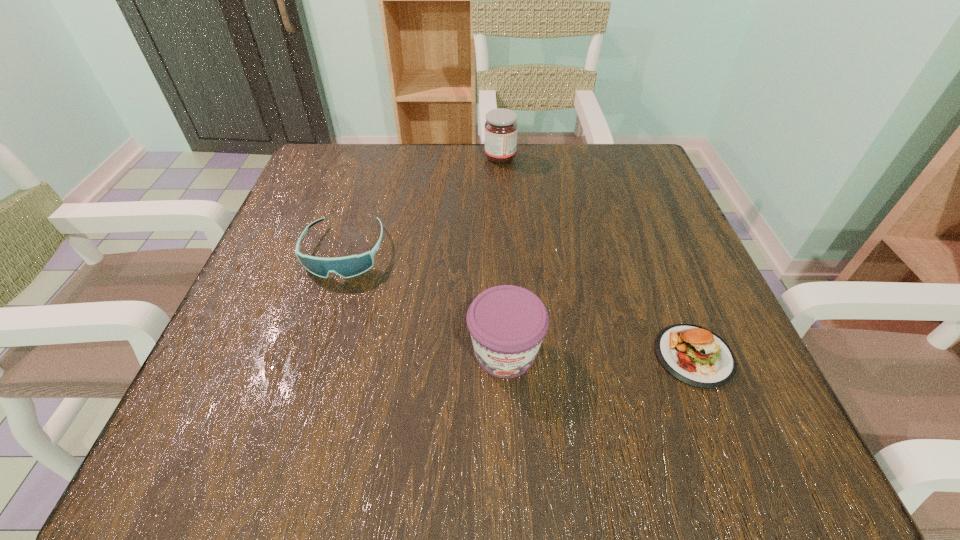
In the image, there is a desktop. Where is `vacant region at the near right corner`? The image size is (960, 540). vacant region at the near right corner is located at coordinates click(695, 417).

This screenshot has height=540, width=960. Identify the location of empty space between the nearer jam and the second shortest object. (425, 302).

Where is `free space between the farther jam and the leftmost object`? The width and height of the screenshot is (960, 540). free space between the farther jam and the leftmost object is located at coordinates (422, 205).

You are a GUI agent. You are given a task and a screenshot of the screen. Output one action in this format:
    pyautogui.click(x=<x>, y=<y>)
    Task: Click on the free spot between the farthest object and the leftmost object
    The width and height of the screenshot is (960, 540).
    Given the screenshot: What is the action you would take?
    pyautogui.click(x=422, y=205)

At what (x,y) coordinates should I click in order to perform the action: click on vacant space in between the nearer jam and the farther jam. Please return your answer as a coordinate pair (x, y). This screenshot has height=540, width=960. Looking at the image, I should click on (503, 255).

Locate an element on the screen. The height and width of the screenshot is (540, 960). unoccupied area between the shortest object and the nearer jam is located at coordinates (600, 354).

Locate an element on the screen. free space between the second farthest object and the nearer jam is located at coordinates (425, 302).

The height and width of the screenshot is (540, 960). I want to click on free spot between the farthest object and the nearer jam, so click(x=503, y=255).

Find the location of a particular element. This screenshot has height=540, width=960. free space between the nearer jam and the farther jam is located at coordinates pos(503,255).

What are the coordinates of `free space between the nearer jam and the patty (food)` in the screenshot? It's located at (600, 354).